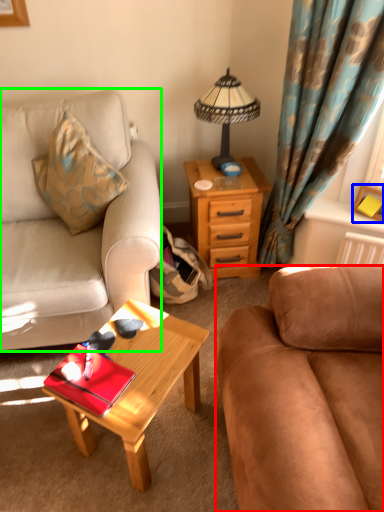
Question: Considering the real-world distances, which object is farthest from studio couch (highlighted by a red box)? picture frame (highlighted by a blue box) or studio couch (highlighted by a green box)?

Choices:
 (A) picture frame
 (B) studio couch

Answer: (A)